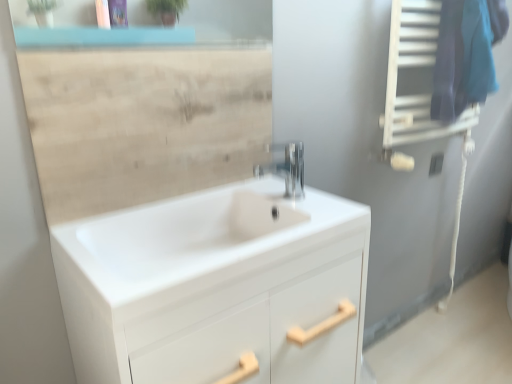
Question: Are beige wood mirror at upper center and polished chrome faucet at center located far from each other?

Choices:
 (A) yes
 (B) no

Answer: (B)

Question: Does beige wood mirror at upper center have a smaller size compared to polished chrome faucet at center?

Choices:
 (A) no
 (B) yes

Answer: (A)

Question: Is the position of beige wood mirror at upper center less distant than that of polished chrome faucet at center?

Choices:
 (A) yes
 (B) no

Answer: (A)

Question: Is beige wood mirror at upper center further to camera compared to polished chrome faucet at center?

Choices:
 (A) no
 (B) yes

Answer: (A)

Question: From the image's perspective, does beige wood mirror at upper center appear higher than polished chrome faucet at center?

Choices:
 (A) no
 (B) yes

Answer: (B)

Question: From the image's perspective, is polished chrome faucet at center above or below beige wood mirror at upper center?

Choices:
 (A) below
 (B) above

Answer: (A)

Question: Is polished chrome faucet at center inside or outside of beige wood mirror at upper center?

Choices:
 (A) inside
 (B) outside

Answer: (B)

Question: Considering the positions of polished chrome faucet at center and beige wood mirror at upper center in the image, is polished chrome faucet at center wider or thinner than beige wood mirror at upper center?

Choices:
 (A) wide
 (B) thin

Answer: (A)

Question: Is polished chrome faucet at center bigger or smaller than beige wood mirror at upper center?

Choices:
 (A) small
 (B) big

Answer: (A)

Question: Based on their sizes in the image, would you say white glossy cabinet at center is bigger or smaller than polished chrome faucet at center?

Choices:
 (A) big
 (B) small

Answer: (A)

Question: Relative to polished chrome faucet at center, is white glossy cabinet at center in front or behind?

Choices:
 (A) behind
 (B) front

Answer: (B)

Question: Considering the relative positions of white glossy cabinet at center and polished chrome faucet at center in the image provided, is white glossy cabinet at center to the left or to the right of polished chrome faucet at center?

Choices:
 (A) right
 (B) left

Answer: (B)

Question: From the image's perspective, is white glossy cabinet at center above or below polished chrome faucet at center?

Choices:
 (A) below
 (B) above

Answer: (A)

Question: Is beige wood mirror at upper center taller or shorter than white glossy cabinet at center?

Choices:
 (A) short
 (B) tall

Answer: (A)

Question: Is beige wood mirror at upper center wider or thinner than white glossy cabinet at center?

Choices:
 (A) wide
 (B) thin

Answer: (B)